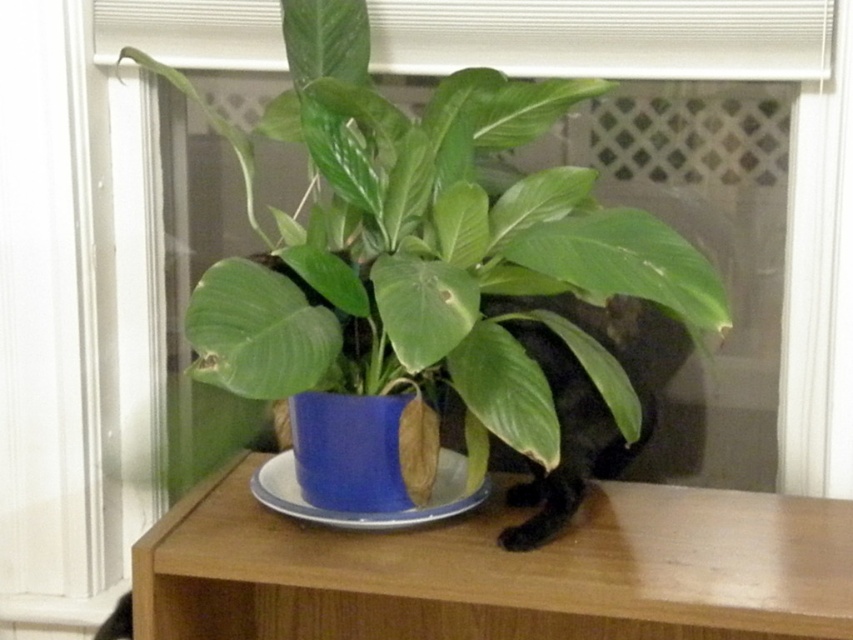
Image resolution: width=853 pixels, height=640 pixels. What do you see at coordinates (434, 284) in the screenshot?
I see `blue glossy pot at center` at bounding box center [434, 284].

Does point (442, 385) come in front of point (289, 508)?

No, it is not.

Between point (602, 365) and point (358, 525), which one is positioned behind?

The point (602, 365) is behind.

Locate an element on the screen. blue glossy pot at center is located at coordinates (434, 284).

Who is positioned more to the left, blue glossy pot at center or wooden shelf at center?

blue glossy pot at center

Who is shorter, blue glossy pot at center or wooden shelf at center?

Standing shorter between the two is wooden shelf at center.

The height and width of the screenshot is (640, 853). Identify the location of blue glossy pot at center. (434, 284).

At what (x,y) coordinates should I click in order to perform the action: click on blue glossy pot at center. Please return your answer as a coordinate pair (x, y). The height and width of the screenshot is (640, 853). Looking at the image, I should click on (434, 284).

Can you confirm if wooden shelf at center is smaller than blue ceramic plate at center?

Actually, wooden shelf at center might be larger than blue ceramic plate at center.

Does wooden shelf at center come behind blue ceramic plate at center?

No, it is not.

Between point (845, 584) and point (363, 524), which one is positioned in front?

Point (845, 584) is more forward.

The width and height of the screenshot is (853, 640). Find the location of `wooden shelf at center`. wooden shelf at center is located at coordinates (500, 570).